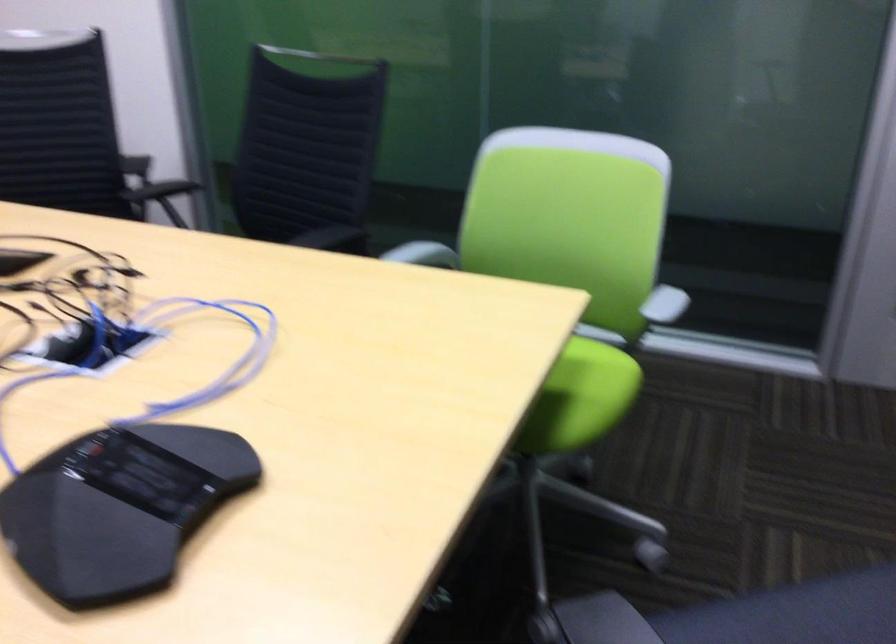
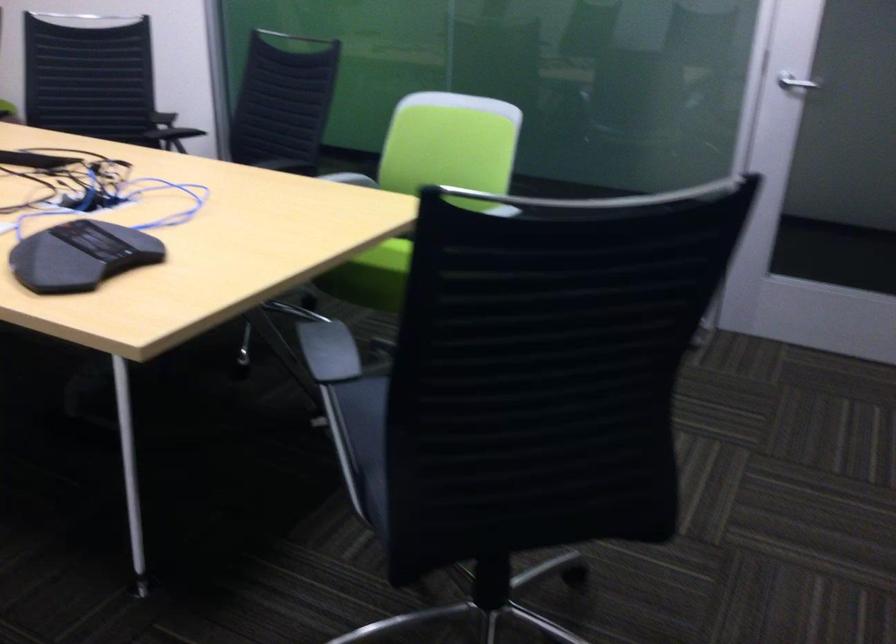
In a continuous first-person perspective shot, in which direction is the camera moving?

The cameraman moved toward right, backward.